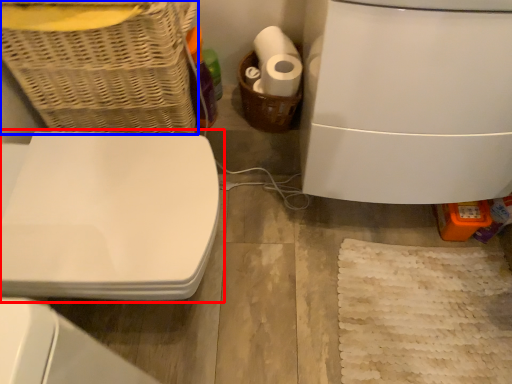
Question: Which object appears closest to the camera in this image, toilet (highlighted by a red box) or basket (highlighted by a blue box)?

Choices:
 (A) toilet
 (B) basket

Answer: (B)